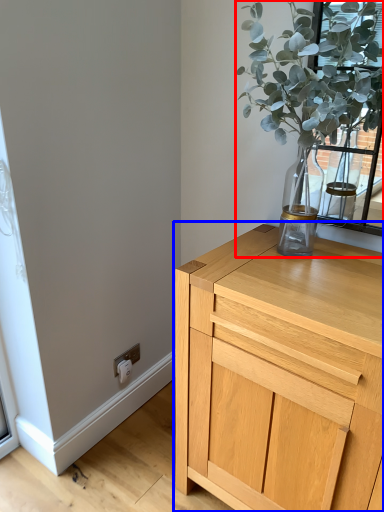
Question: Which object appears closest to the camera in this image, houseplant (highlighted by a red box) or chest of drawers (highlighted by a blue box)?

Choices:
 (A) houseplant
 (B) chest of drawers

Answer: (A)